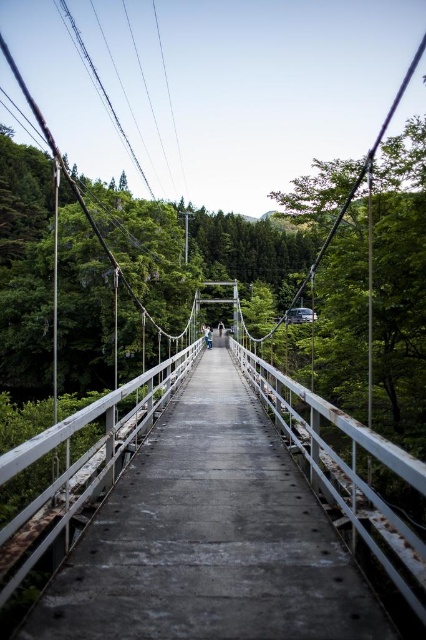
Question: Which point appears farthest from the camera in this image?

Choices:
 (A) (204, 330)
 (B) (242, 403)

Answer: (A)

Question: Is rusty concrete bridge at center wider than light blue denim jacket at center?

Choices:
 (A) no
 (B) yes

Answer: (B)

Question: Which point is closer to the camera?

Choices:
 (A) rusty concrete bridge at center
 (B) light blue denim jacket at center

Answer: (A)

Question: Which object is closer to the camera taking this photo?

Choices:
 (A) rusty concrete bridge at center
 (B) light blue denim jacket at center

Answer: (A)

Question: Where is rusty concrete bridge at center located in relation to light blue denim jacket at center in the image?

Choices:
 (A) left
 (B) right

Answer: (B)

Question: Can you confirm if rusty concrete bridge at center is thinner than light blue denim jacket at center?

Choices:
 (A) no
 (B) yes

Answer: (A)